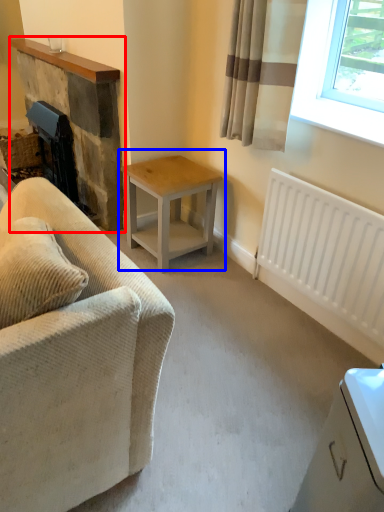
Question: Among these objects, which one is nearest to the camera, fireplace (highlighted by a red box) or table (highlighted by a blue box)?

Choices:
 (A) fireplace
 (B) table

Answer: (B)